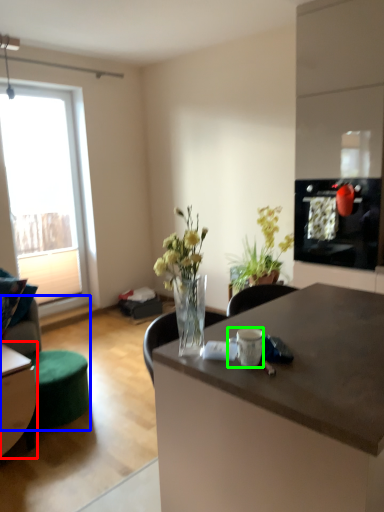
Question: Considering the real-world distances, which object is farthest from table (highlighted by a red box)? swivel chair (highlighted by a blue box) or coffee cup (highlighted by a green box)?

Choices:
 (A) swivel chair
 (B) coffee cup

Answer: (B)